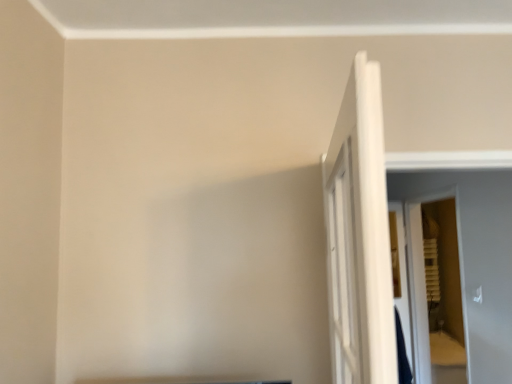
Question: Does white wooden door at right appear on the left side of white wooden screen door at right?

Choices:
 (A) no
 (B) yes

Answer: (B)

Question: Is white wooden door at right smaller than white wooden screen door at right?

Choices:
 (A) no
 (B) yes

Answer: (B)

Question: Is white wooden door at right with white wooden screen door at right?

Choices:
 (A) no
 (B) yes

Answer: (A)

Question: Considering the relative sizes of white wooden door at right and white wooden screen door at right in the image provided, is white wooden door at right taller than white wooden screen door at right?

Choices:
 (A) yes
 (B) no

Answer: (B)

Question: Does white wooden door at right contain white wooden screen door at right?

Choices:
 (A) no
 (B) yes

Answer: (A)

Question: Does white wooden door at right lie behind white wooden screen door at right?

Choices:
 (A) no
 (B) yes

Answer: (A)

Question: From a real-world perspective, is white wooden screen door at right beneath white wooden door at right?

Choices:
 (A) yes
 (B) no

Answer: (A)

Question: Is white wooden screen door at right turned away from white wooden door at right?

Choices:
 (A) yes
 (B) no

Answer: (B)

Question: Considering the relative sizes of white wooden screen door at right and white wooden door at right in the image provided, is white wooden screen door at right taller than white wooden door at right?

Choices:
 (A) yes
 (B) no

Answer: (A)

Question: Is white wooden screen door at right outside white wooden door at right?

Choices:
 (A) yes
 (B) no

Answer: (A)

Question: Could you tell me if white wooden screen door at right is turned towards white wooden door at right?

Choices:
 (A) yes
 (B) no

Answer: (B)

Question: Does white wooden screen door at right contain white wooden door at right?

Choices:
 (A) no
 (B) yes

Answer: (A)

Question: In terms of height, does white wooden door at right look taller or shorter compared to white wooden screen door at right?

Choices:
 (A) short
 (B) tall

Answer: (A)